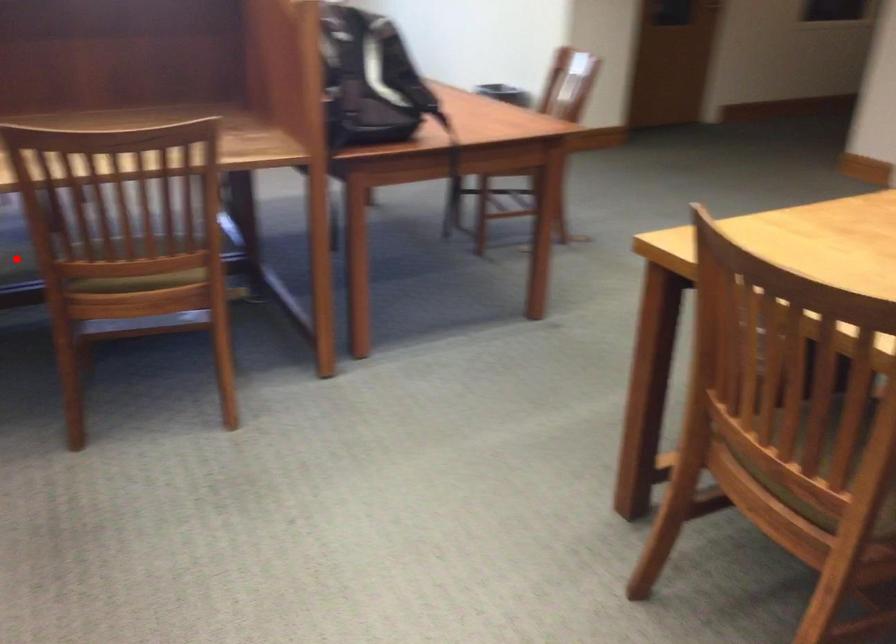
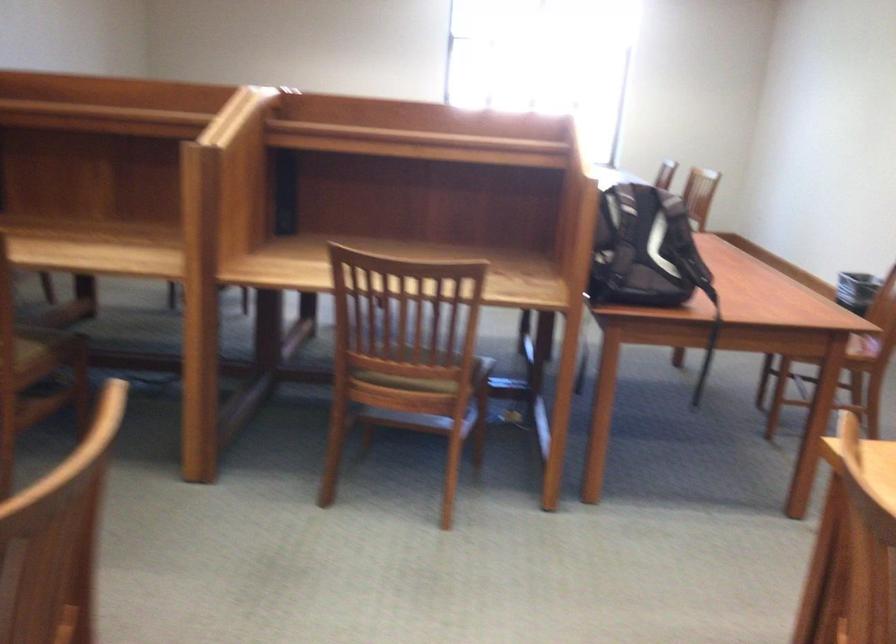
Question: I am providing you with two images of the same scene from different viewpoints. A red point is marked on the first image. Is the red point's position out of view in image 2?

Choices:
 (A) Yes
 (B) No

Answer: (A)